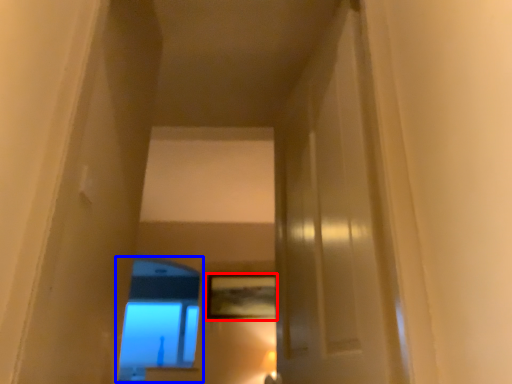
Question: Which of the following is the farthest to the observer, picture frame (highlighted by a red box) or window (highlighted by a blue box)?

Choices:
 (A) picture frame
 (B) window

Answer: (B)